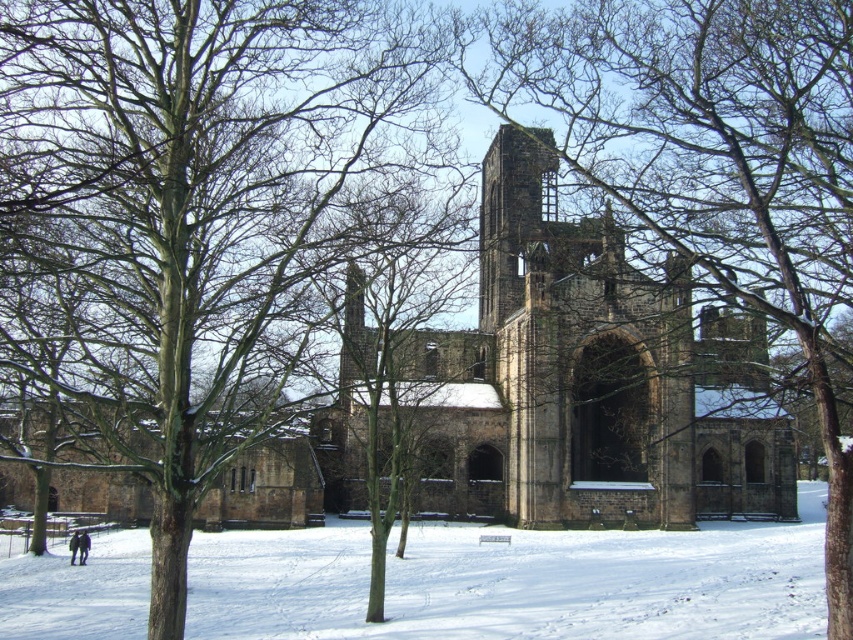
Consider the image. You are an artist trying to sketch the winter scene. You notice the smooth bark tree at center and the dark blue jacket at lower left. Which object should you draw first if you want to capture the larger width in your sketch?

The smooth bark tree at center should be drawn first because its width is larger than the dark blue jacket at lower left.

You are standing in the winter scene and want to place a small decorative snowman next to the dark blue jacket at lower left. However, you need to ensure it won not be covered by the smooth bark tree at center. Can you confirm if the snowman will be visible once placed there?

Result: The smooth bark tree at center is located above the dark blue jacket at lower left, so placing the snowman next to the dark blue jacket at lower left might result in it being partially or fully obscured by the tree. Choose a different spot to ensure visibility.

From the picture: You are standing at the ruins of a historic stone building in winter and notice a point marked at coordinates (515, 580). What is located at that point?

The point at coordinates (515, 580) indicates white powdery snow at lower center.